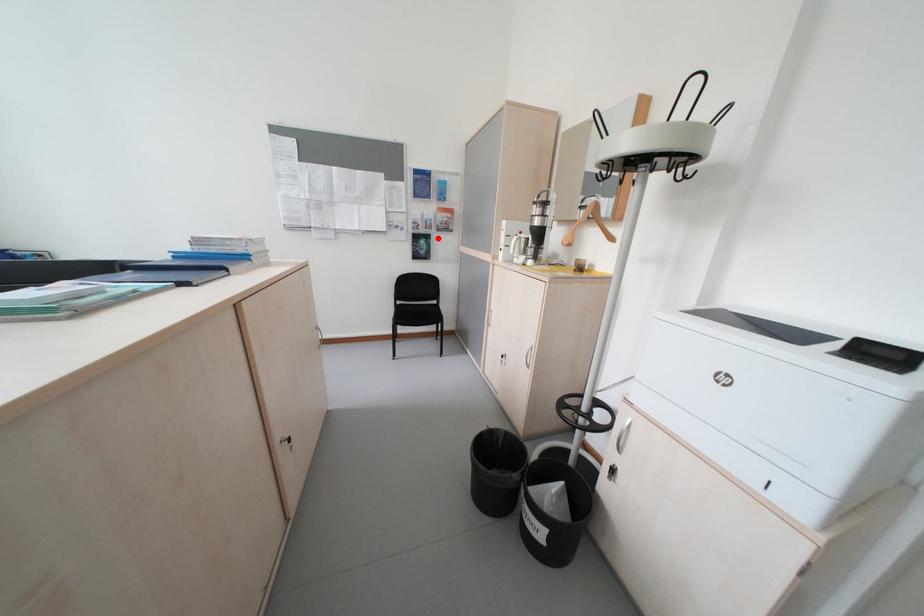
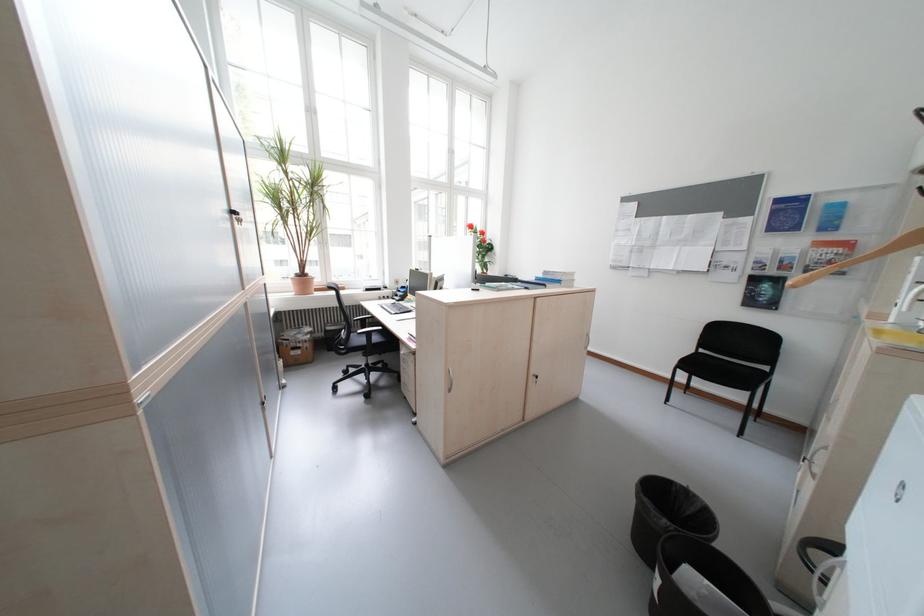
Question: I am providing you with two images of the same scene from different viewpoints. Image1 has a red point marked. In image2, the corresponding 3D location appears at what relative position? Reply with the corresponding letter.

Choices:
 (A) Closer
 (B) Farther

Answer: (B)